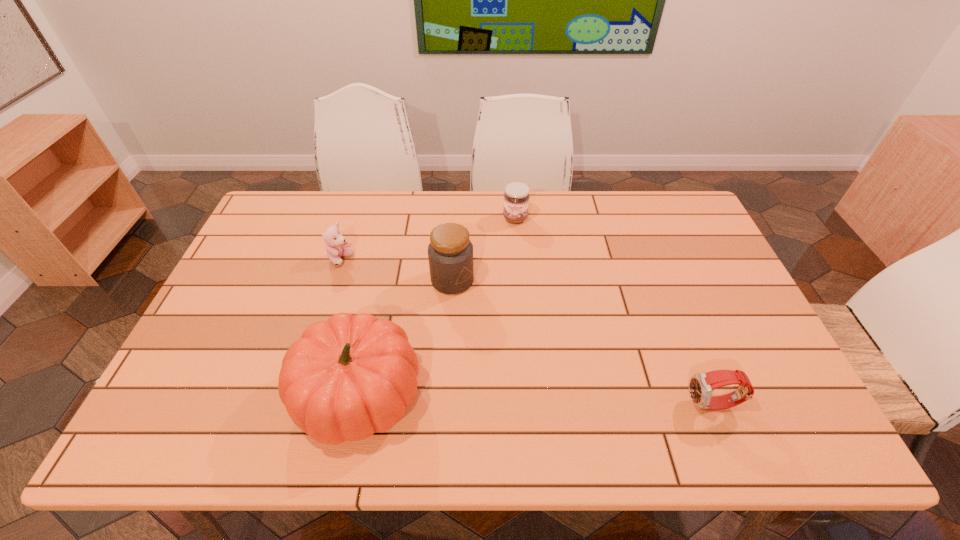
Identify the location of vacant spot on the desktop that is between the pumpkin and the watch and is positioned on the front label of the jam. The width and height of the screenshot is (960, 540). (492, 399).

Where is `free spot on the desktop that is between the pumpkin and the rightmost object and is positioned at the face of the teddy bear`? free spot on the desktop that is between the pumpkin and the rightmost object and is positioned at the face of the teddy bear is located at coordinates (482, 399).

The height and width of the screenshot is (540, 960). In order to click on vacant spot on the desktop that is between the pumpkin and the watch and is positioned on the surface of the jar near the warning symbol in this screenshot , I will do `click(558, 401)`.